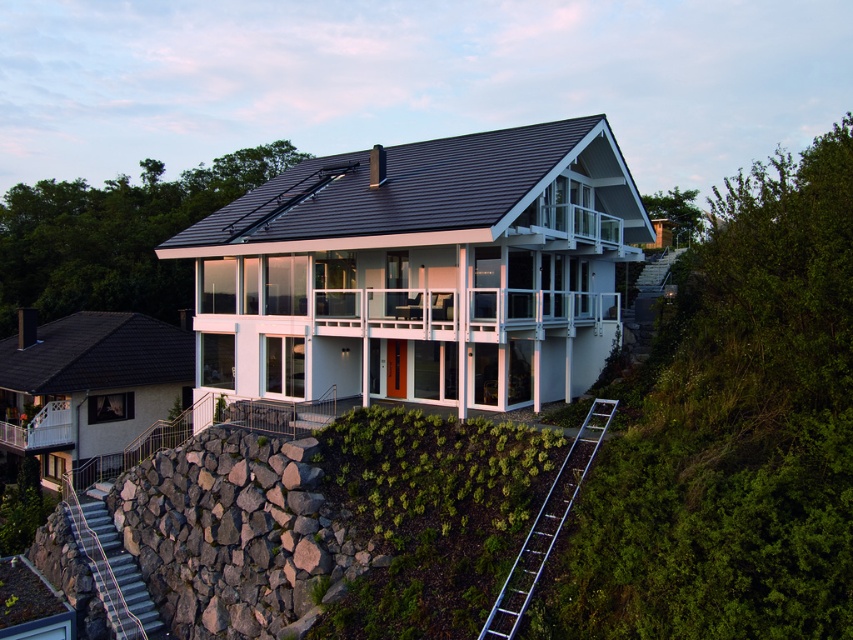
You are standing on the first floor of the modern house and want to reach the second floor balcony. The white glass railing at center and silver metallic ladder at lower right are in your view. Which object should you use to ascend to the balcony?

You should use the silver metallic ladder at lower right to ascend to the balcony because the white glass railing at center is located above it, indicating the ladder is positioned lower and accessible from the first floor.

You are standing in front of the house and see two points marked on the house. The first point is at coordinates point [517,300] and the second is at point [595,432]. Which point is closer to you?

Point [517,300] is further to the camera than point [595,432], so the point closer to you is point [595,432].